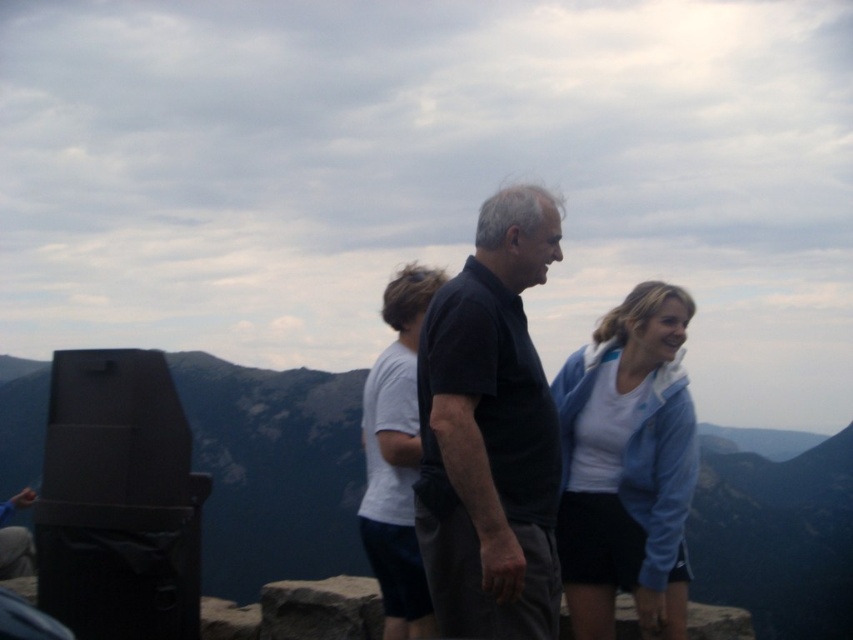
Which is behind, point (529, 403) or point (692, 452)?

Point (692, 452)

From the picture: Does black matte shirt at center come behind light blue jacket at center?

No, it is in front of light blue jacket at center.

In the scene shown: Who is more distant from viewer, (498, 324) or (585, 380)?

The point (585, 380) is behind.

Where is `black matte shirt at center`? black matte shirt at center is located at coordinates (490, 433).

Can you confirm if matte black grill at center-left is thinner than light blue jacket at center?

No.

Who is more distant from viewer, (213, 557) or (589, 630)?

The point (213, 557) is behind.

The width and height of the screenshot is (853, 640). Identify the location of matte black grill at center-left. (273, 470).

The width and height of the screenshot is (853, 640). Identify the location of matte black grill at center-left. (273, 470).

Locate an element on the screen. This screenshot has width=853, height=640. dark blue shirt at center is located at coordinates tap(489, 433).

How distant is dark blue shirt at center from light blue jacket at center?

dark blue shirt at center is 5.57 feet from light blue jacket at center.

Where is `dark blue shirt at center`? dark blue shirt at center is located at coordinates pyautogui.click(x=489, y=433).

Locate an element on the screen. Image resolution: width=853 pixels, height=640 pixels. dark blue shirt at center is located at coordinates (489, 433).